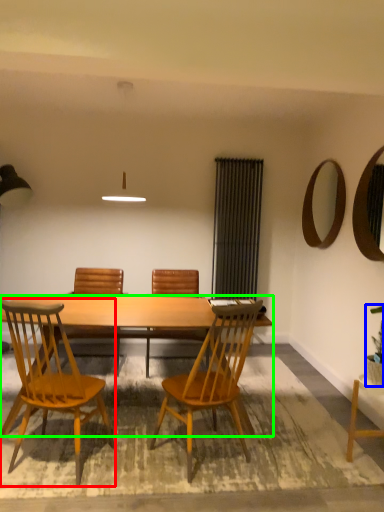
Question: Which object is the closest to the chair (highlighted by a red box)? Choose among these: houseplant (highlighted by a blue box) or desk (highlighted by a green box).

Choices:
 (A) houseplant
 (B) desk

Answer: (B)